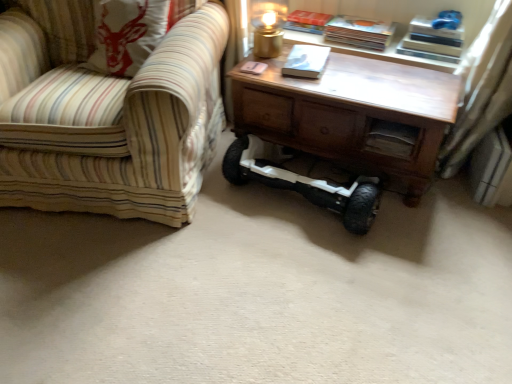
I want to click on free location in front of white matte book at center, marked as the first book in a front-to-back arrangement, so 320,87.